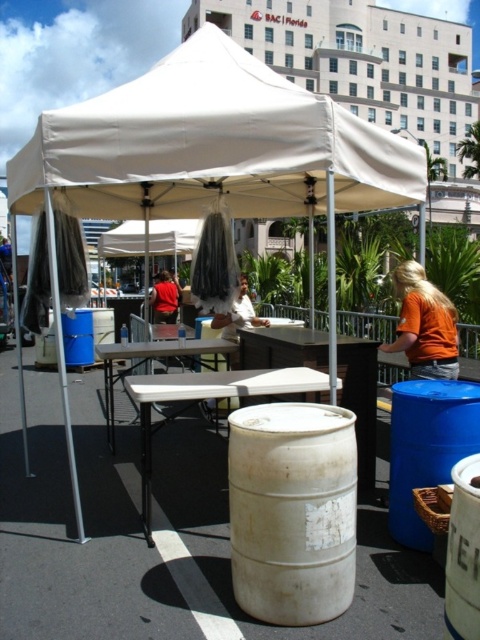
Can you confirm if white fabric tent at center is positioned below matte red shirt at center?

Incorrect, white fabric tent at center is not positioned below matte red shirt at center.

Is white fabric tent at center shorter than matte red shirt at center?

No.

What do you see at coordinates (215, 150) in the screenshot? This screenshot has height=640, width=480. I see `white fabric tent at center` at bounding box center [215, 150].

Locate an element on the screen. Image resolution: width=480 pixels, height=640 pixels. white fabric tent at center is located at coordinates (215, 150).

Is white matte barrel at center to the left of white matte barrel at lower right from the viewer's perspective?

Yes, white matte barrel at center is to the left of white matte barrel at lower right.

Describe the element at coordinates (292, 509) in the screenshot. I see `white matte barrel at center` at that location.

The height and width of the screenshot is (640, 480). I want to click on white matte barrel at center, so click(x=292, y=509).

Is the position of blue plastic barrel at lower right more distant than that of white matte barrel at lower right?

That is True.

Between point (433, 381) and point (450, 541), which one is positioned in front?

Point (450, 541) is in front.

Is point (444, 420) more distant than point (456, 488)?

Yes, point (444, 420) is farther from viewer.

Where is `blue plastic barrel at lower right`? This screenshot has width=480, height=640. blue plastic barrel at lower right is located at coordinates (427, 445).